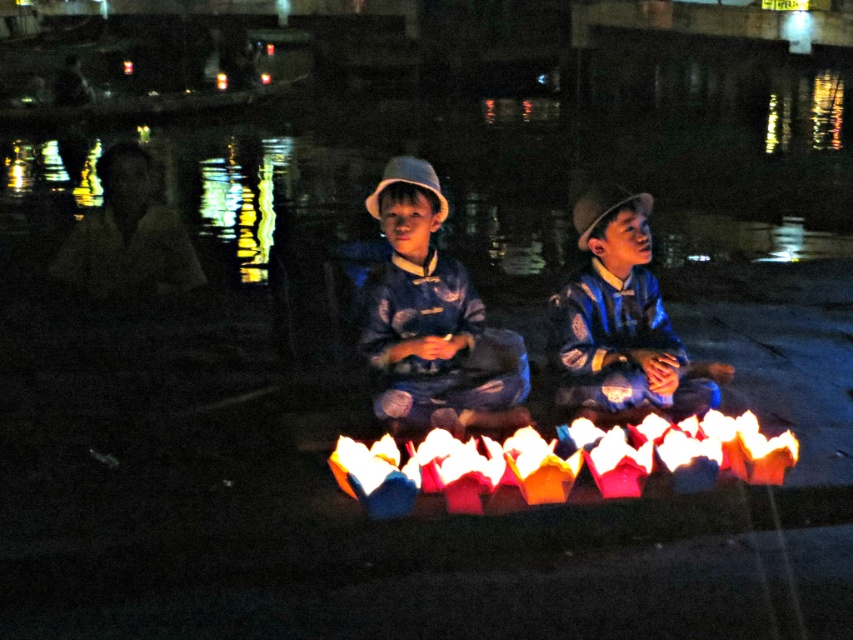
Is matte blue fabric at center to the left of blue striped shirt at center from the viewer's perspective?

Correct, you'll find matte blue fabric at center to the left of blue striped shirt at center.

Is matte blue fabric at center above blue striped shirt at center?

Yes, matte blue fabric at center is above blue striped shirt at center.

Which is in front, point (479, 340) or point (556, 344)?

Positioned in front is point (479, 340).

Locate an element on the screen. matte blue fabric at center is located at coordinates (433, 321).

Does multicolored paper lanterns at center appear under blue striped shirt at center?

Yes.

Does multicolored paper lanterns at center have a greater height compared to blue striped shirt at center?

Incorrect, multicolored paper lanterns at center's height is not larger of blue striped shirt at center's.

This screenshot has height=640, width=853. I want to click on multicolored paper lanterns at center, so click(563, 461).

The image size is (853, 640). In order to click on multicolored paper lanterns at center in this screenshot , I will do `click(563, 461)`.

Is matte blue fabric at center wider than multicolored paper lanterns at center?

No, matte blue fabric at center is not wider than multicolored paper lanterns at center.

Based on the photo, who is taller, matte blue fabric at center or multicolored paper lanterns at center?

Standing taller between the two is matte blue fabric at center.

Is point (386, 352) positioned in front of point (699, 440)?

No, it is behind (699, 440).

You are a GUI agent. You are given a task and a screenshot of the screen. Output one action in this format:
    pyautogui.click(x=<x>, y=<y>)
    Task: Click on the matte blue fabric at center
    
    Given the screenshot: What is the action you would take?
    pyautogui.click(x=433, y=321)